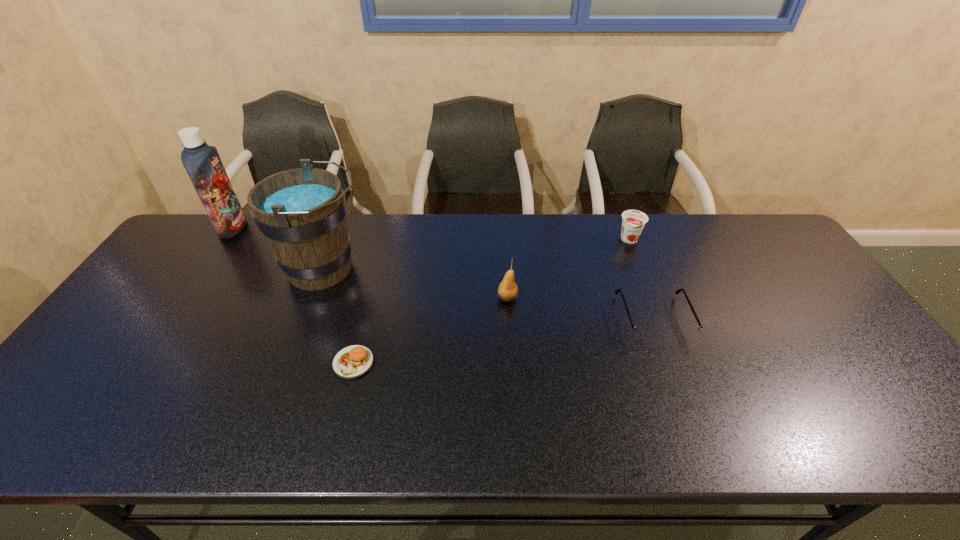
Where is `blank space at the near edge of the desktop`? This screenshot has width=960, height=540. blank space at the near edge of the desktop is located at coordinates (752, 448).

Locate an element on the screen. This screenshot has width=960, height=540. free space at the left edge is located at coordinates (136, 360).

Locate an element on the screen. free point between the fourth object from left to right and the shampoo is located at coordinates (371, 263).

Locate an element on the screen. empty location between the shampoo and the fifth tallest object is located at coordinates (444, 274).

Where is `free space that is in between the shortest object and the second shortest object`? free space that is in between the shortest object and the second shortest object is located at coordinates (504, 341).

At what (x,y) coordinates should I click in order to perform the action: click on vacant region between the shampoo and the third shortest object. Please return your answer as a coordinate pair (x, y). Looking at the image, I should click on (431, 234).

Where is `vacant region between the fourth tallest object and the leftmost object`? vacant region between the fourth tallest object and the leftmost object is located at coordinates (431, 234).

Locate an element on the screen. This screenshot has height=540, width=960. vacant region between the fourth tallest object and the shampoo is located at coordinates (431, 234).

Locate an element on the screen. vacant space that is in between the fifth tallest object and the shampoo is located at coordinates (444, 274).

Identify the location of free space between the wine bucket and the shortest object. This screenshot has width=960, height=540. (339, 315).